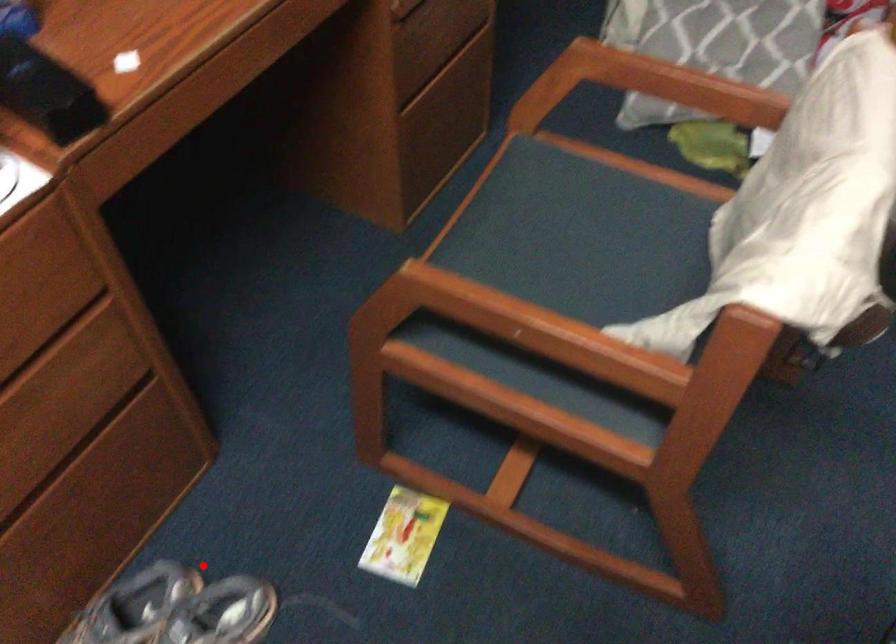
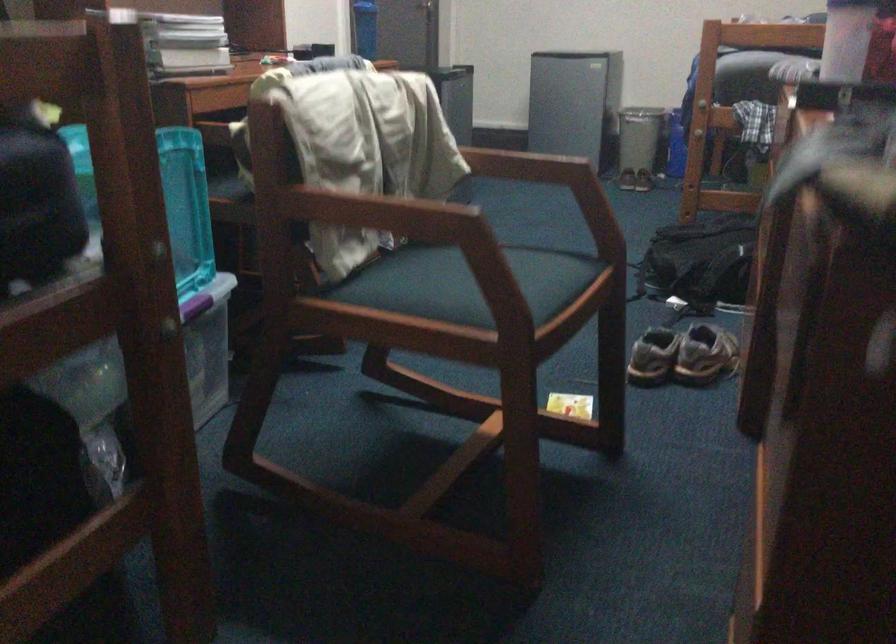
In the second image, find the point that corresponds to the highlighted location in the first image.

(682, 355)